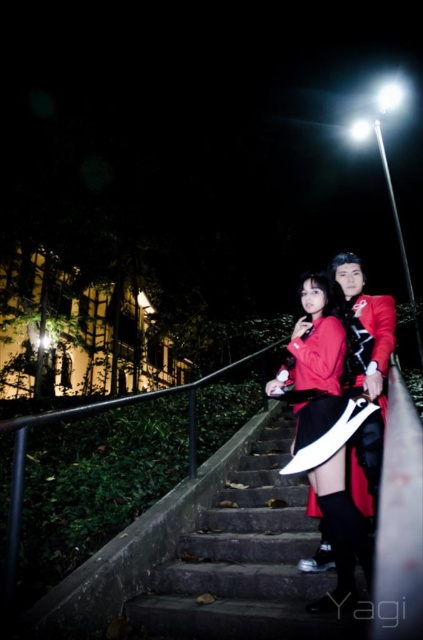
You are a photographer trying to capture a photo of the matte red jacket at center without the smooth concrete stairs at center appearing in the frame. Is it possible to do so by adjusting your camera angle?

The smooth concrete stairs at center is positioned under the matte red jacket at center, so adjusting the camera angle upwards might allow you to frame the matte red jacket at center while excluding the stairs.